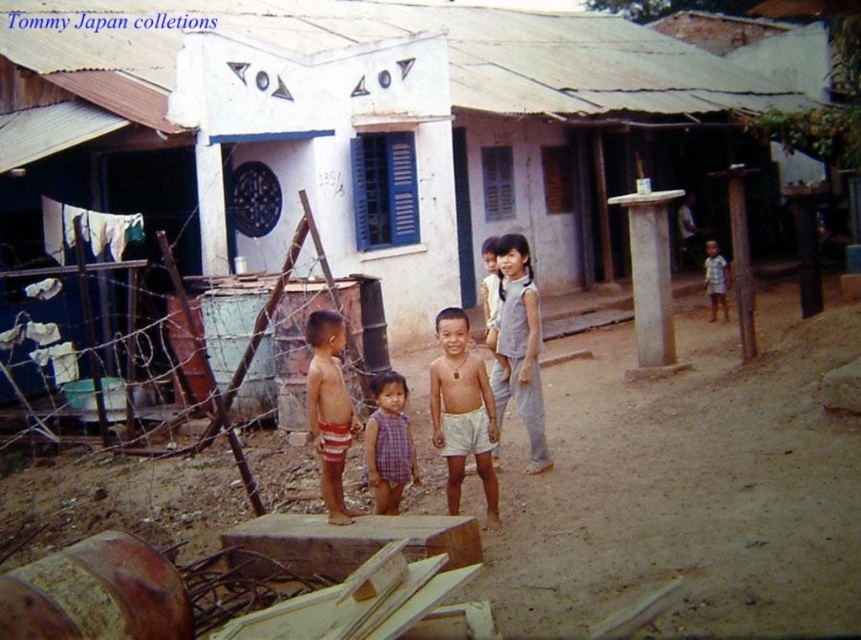
You are standing at the barbed wire fence in the rural village scene. You see a point marked at coordinates (689, 483). What is located at that point?

The point at coordinates (689, 483) indicates brown sandy ground at center.

You are a photographer trying to capture the scene in front of you. You notice a point at coordinates (329, 410). Based on the scene description, what object is located at that specific coordinate?

The point at coordinates (329, 410) is located on reddish brown shorts at center.